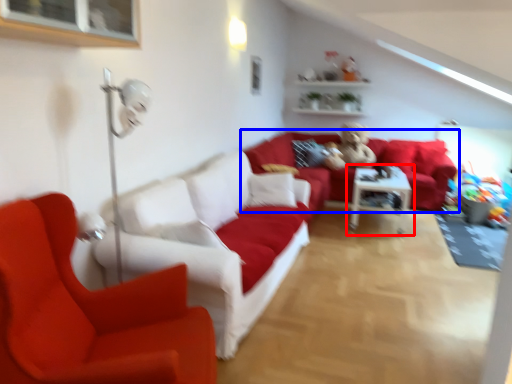
Question: Which object appears closest to the camera in this image, table (highlighted by a red box) or studio couch (highlighted by a blue box)?

Choices:
 (A) table
 (B) studio couch

Answer: (A)